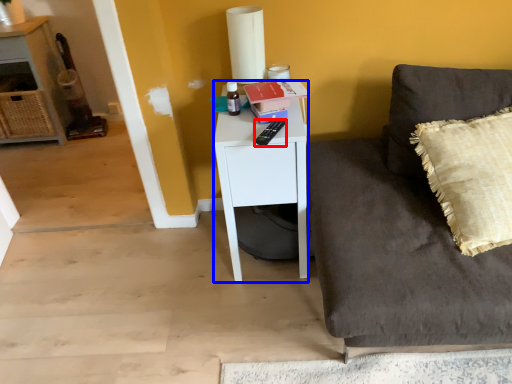
Question: Among these objects, which one is farthest to the camera, remote control (highlighted by a red box) or desk (highlighted by a blue box)?

Choices:
 (A) remote control
 (B) desk

Answer: (B)